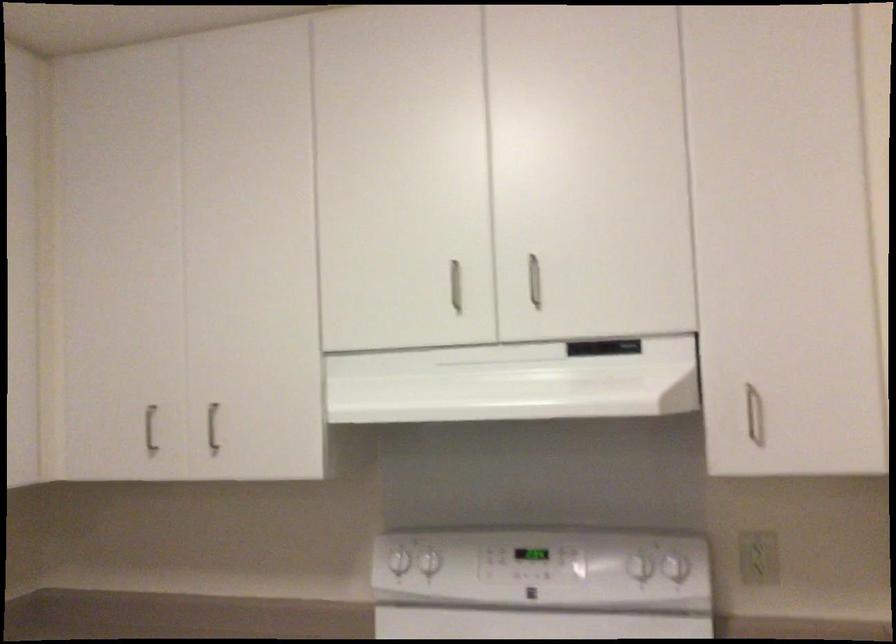
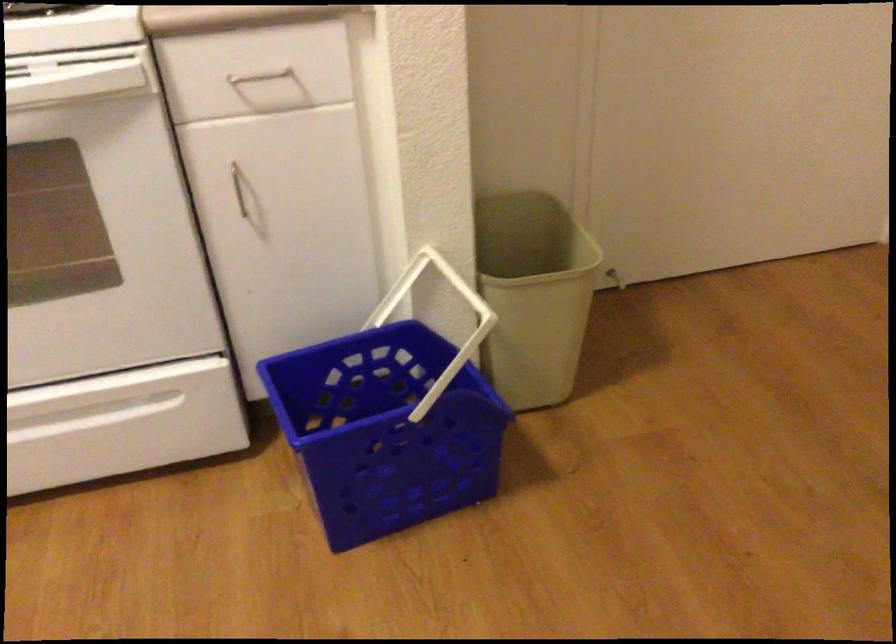
The images are taken continuously from a first-person perspective. In which direction is your viewpoint rotating?

The camera's rotation is toward right-down.